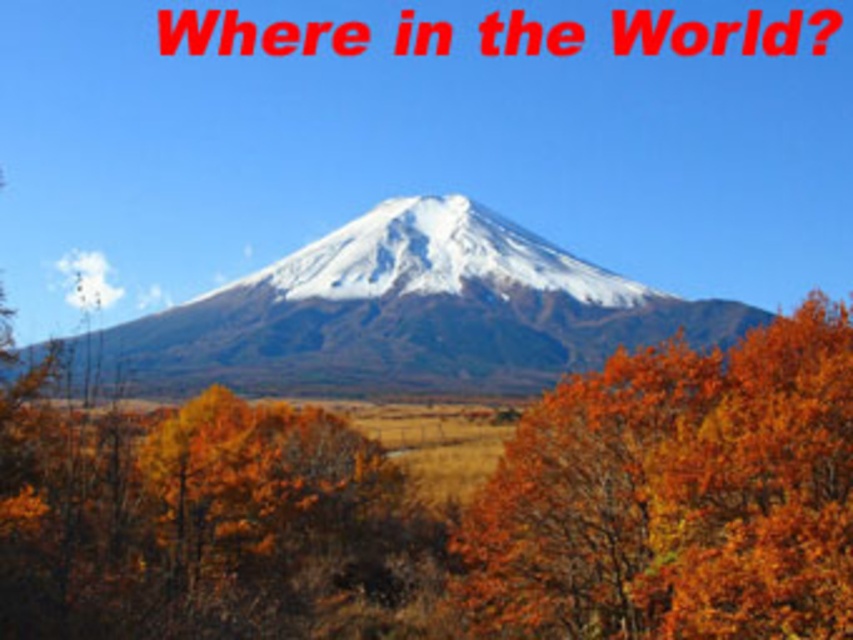
Who is positioned more to the right, orange matte tree at right or white snow-covered mountain at center?

From the viewer's perspective, orange matte tree at right appears more on the right side.

Is orange matte tree at right bigger than white snow-covered mountain at center?

No.

This screenshot has width=853, height=640. What do you see at coordinates (677, 497) in the screenshot?
I see `orange matte tree at right` at bounding box center [677, 497].

Where is `orange matte tree at right`? orange matte tree at right is located at coordinates (677, 497).